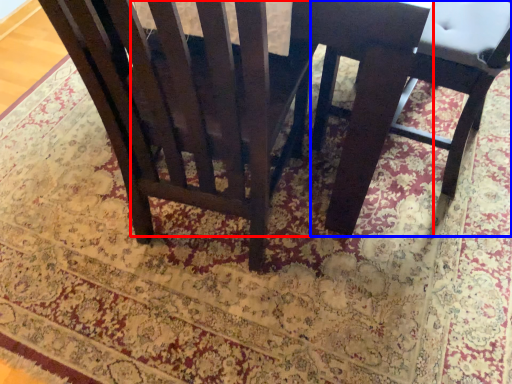
Question: Among these objects, which one is nearest to the camera, round table (highlighted by a red box) or chair (highlighted by a blue box)?

Choices:
 (A) round table
 (B) chair

Answer: (A)